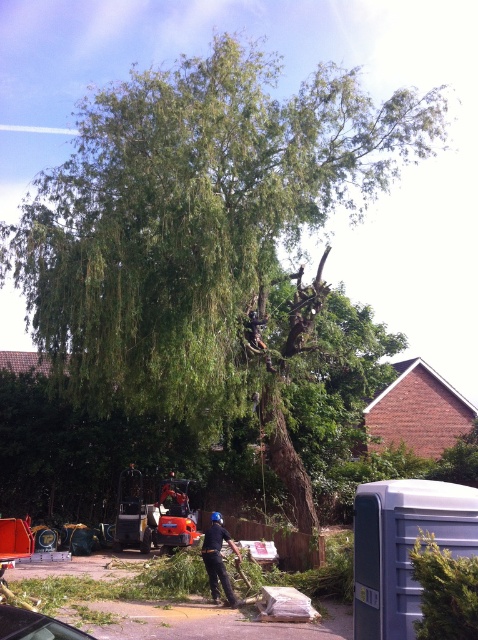
You are a delivery driver who needs to park your car in the residential area shown. You see a metallic gray car at lower left and a black fabric person at center. Which object is smaller and should be easier to maneuver around?

The metallic gray car at lower left is smaller than the black fabric person at center, so it would be easier to maneuver around the metallic gray car at lower left.

You are a delivery person who needs to park your van in the driveway. The driveway is on the right side of the image. There is a metallic gray car at lower left and a black fabric person at center in the scene. Which object is blocking the driveway entrance?

The metallic gray car at lower left is to the left of the black fabric person at center, so the metallic gray car at lower left is closer to the driveway entrance and is blocking it.